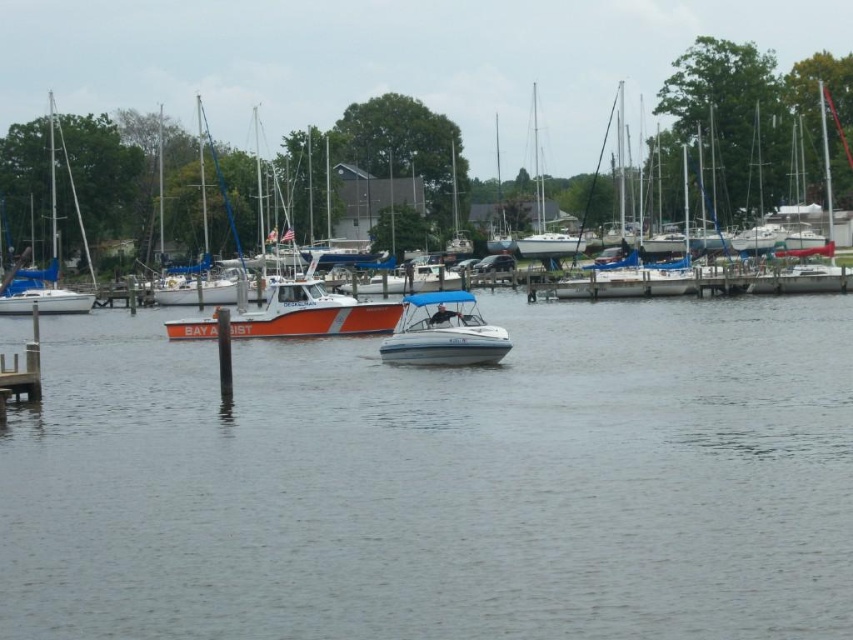
Which is more to the right, clear water at center or white plastic boat at center?

white plastic boat at center is more to the right.

Which is in front, point (843, 404) or point (604, 136)?

Point (843, 404) is more forward.

Locate an element on the screen. This screenshot has width=853, height=640. clear water at center is located at coordinates (440, 481).

In the scene shown: Is white matte boat at center taller than blue sailboat at left?

No.

Can you confirm if white matte boat at center is positioned to the right of blue sailboat at left?

Yes, white matte boat at center is to the right of blue sailboat at left.

You are a GUI agent. You are given a task and a screenshot of the screen. Output one action in this format:
    pyautogui.click(x=<x>, y=<y>)
    Task: Click on the white matte boat at center
    The width and height of the screenshot is (853, 640).
    Given the screenshot: What is the action you would take?
    pyautogui.click(x=444, y=332)

Between point (143, 314) and point (410, 333), which one is positioned behind?

Positioned behind is point (143, 314).

Which is in front, point (364, 484) or point (460, 296)?

Point (364, 484) is in front.

Does point (723, 419) lie in front of point (440, 298)?

That is True.

The image size is (853, 640). Find the location of `clear water at center`. clear water at center is located at coordinates (440, 481).